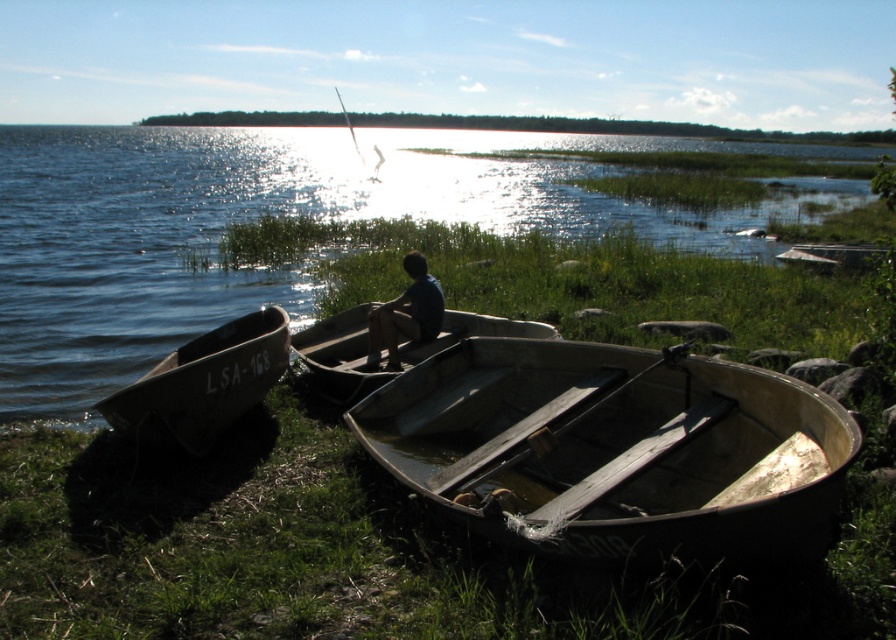
Measure the distance between point (576,541) and camera.

Point (576,541) is 3.76 meters from camera.

Between rusty metal boat at lower right and matte gray canoe at center, which one appears on the right side from the viewer's perspective?

From the viewer's perspective, rusty metal boat at lower right appears more on the right side.

In the scene shown: Measure the distance between rusty metal boat at lower right and camera.

The distance of rusty metal boat at lower right from camera is 3.31 meters.

Where is `rusty metal boat at lower right`? This screenshot has width=896, height=640. rusty metal boat at lower right is located at coordinates (616, 449).

Does point (735, 368) come closer to viewer compared to point (412, 282)?

Yes, point (735, 368) is in front of point (412, 282).

Does rusty metal boat at lower right appear over blue matte shirt at center?

No, rusty metal boat at lower right is not above blue matte shirt at center.

Between point (679, 525) and point (403, 292), which one is positioned behind?

The point (403, 292) is behind.

This screenshot has height=640, width=896. Find the location of `rusty metal boat at lower right`. rusty metal boat at lower right is located at coordinates (616, 449).

Is rusty metal boat at lower right closer to the viewer compared to greenish metallic boat at lower left?

That is True.

The image size is (896, 640). What do you see at coordinates (616, 449) in the screenshot?
I see `rusty metal boat at lower right` at bounding box center [616, 449].

At what (x,y) coordinates should I click in order to perform the action: click on rusty metal boat at lower right. Please return your answer as a coordinate pair (x, y). Looking at the image, I should click on (616, 449).